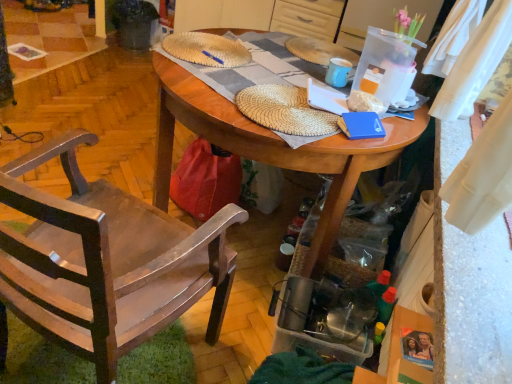
Identify the location of vacant area on the back side of woven straw hat at center, the first hat when ordered from front to back. (272, 64).